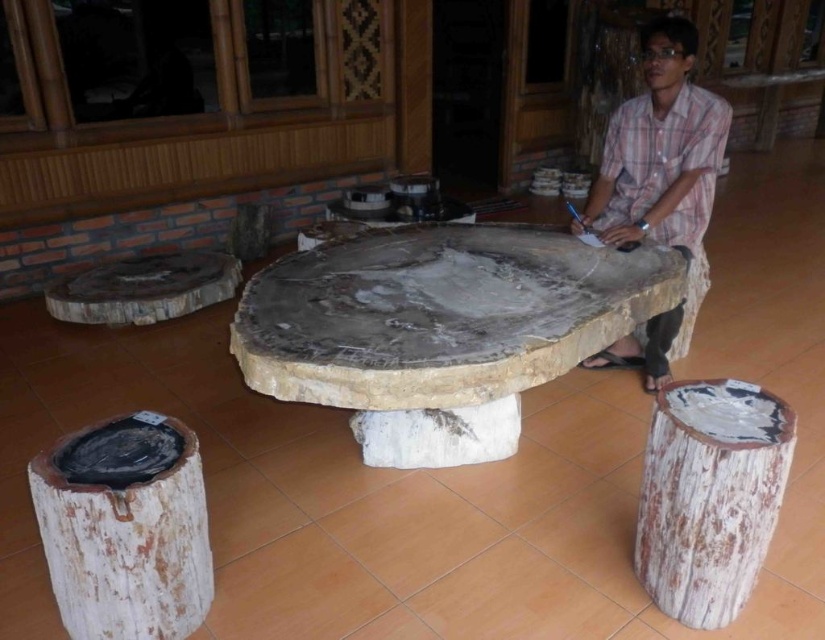
You are standing in a room with a large table made of natural stone. There is a point at coordinates (439, 330). Can you tell me if this point is located on the natural stone table at center?

Yes, the point (439, 330) is on the natural stone table at center.

You are a photographer setting up a shoot in this room. You want to position a spotlight so that it illuminates the natural stone table at center without casting a shadow on the plaid shirt at center. Is this possible based on their positions?

The natural stone table at center is in front of the plaid shirt at center, so placing the spotlight behind the plaid shirt at center would allow the light to hit the table while keeping the shirt out of the shadow area.

You are a guest at a dinner party and see the natural stone table at center and the plaid shirt at center. Which object is located to the left of the other?

The natural stone table at center is positioned on the left side of plaid shirt at center, so the natural stone table at center is to the left of the plaid shirt at center.